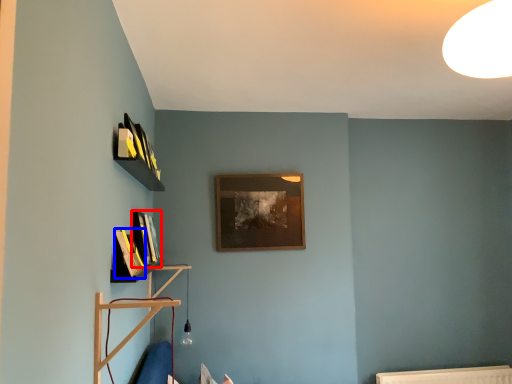
Question: Which object is further to the camera taking this photo, book (highlighted by a red box) or book (highlighted by a blue box)?

Choices:
 (A) book
 (B) book

Answer: (A)